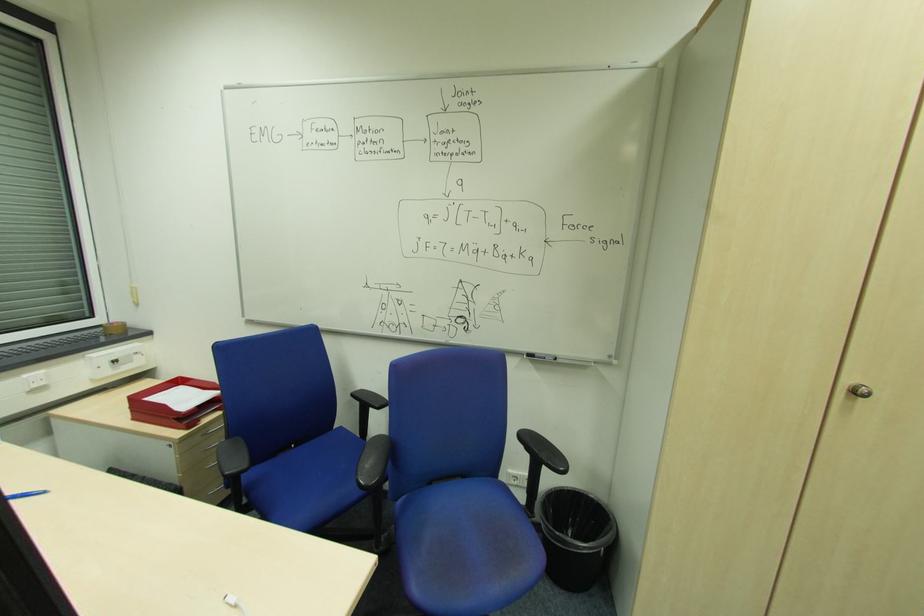
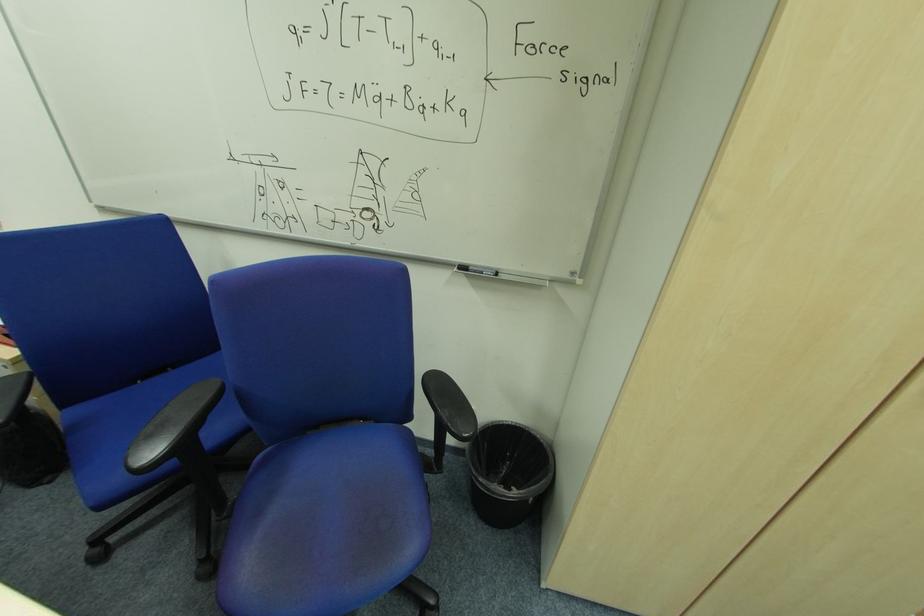
In a continuous first-person perspective shot, in which direction is the camera moving?

The movement direction of the cameraman is right, forward.